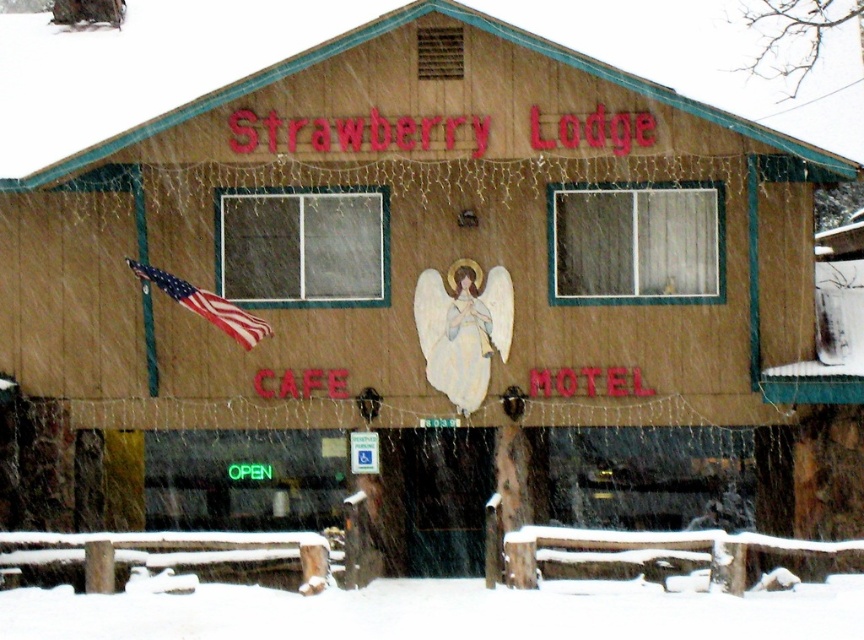
In the scene shown: You are a customer standing at the entrance of Strawberry Lodge. You notice the pastel blue fabric angel at center and the american flag at left. Which object is closer to you?

The pastel blue fabric angel at center is closer to you because the american flag at left is behind it.

You are standing directly in front of the building named Strawberry Lodge. There is a point marked at coordinates (462, 328) on the facade. What object is located at this point?

The point at coordinates (462, 328) marks the location of the pastel blue fabric angel at center.